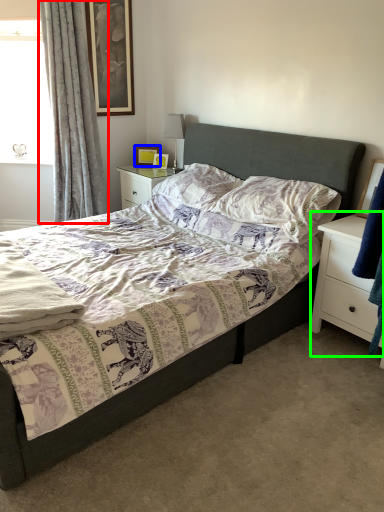
Question: Based on their relative distances, which object is farther from curtain (highlighted by a red box)? Choose from picture frame (highlighted by a blue box) and nightstand (highlighted by a green box).

Choices:
 (A) picture frame
 (B) nightstand

Answer: (B)